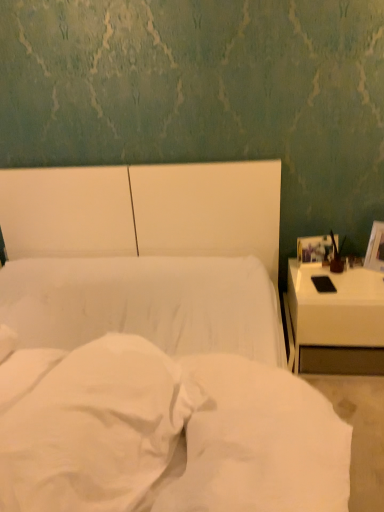
The height and width of the screenshot is (512, 384). Identify the location of white glossy nightstand at right. (335, 321).

In the scene shown: From the image's perspective, does white soft fabric at center appear higher than white fabric bed at center?

No.

From a real-world perspective, is white soft fabric at center positioned above or below white fabric bed at center?

Clearly, from a real-world perspective, white soft fabric at center is above white fabric bed at center.

What are the coordinates of `sheet located above the white fabric bed at center (from a real-world perspective)` in the screenshot? It's located at (260, 443).

Where is `sheet that is below the white glossy nightstand at right (from the image's perspective)`? sheet that is below the white glossy nightstand at right (from the image's perspective) is located at coordinates (260, 443).

Is white glossy nightstand at right in contact with white soft fabric at center?

No, white glossy nightstand at right is not in contact with white soft fabric at center.

From the image's perspective, is white glossy nightstand at right below white soft fabric at center?

No.

Can you tell me how much white soft pillow at center and matte brown vase at right differ in facing direction?

There is a 64-degree angle between the facing directions of white soft pillow at center and matte brown vase at right.

From the image's perspective, who appears lower, white soft pillow at center or matte brown vase at right?

white soft pillow at center, from the image's perspective.

Considering the positions of objects white soft pillow at center and matte brown vase at right in the image provided, who is behind, white soft pillow at center or matte brown vase at right?

matte brown vase at right is more distant.

Is white soft pillow at center wider than matte brown vase at right?

Yes, white soft pillow at center is wider than matte brown vase at right.

From a real-world perspective, between white soft fabric at center and matte brown vase at right, who is vertically higher?

In real-world perspective, white soft fabric at center is above.

Considering the relative sizes of white soft fabric at center and matte brown vase at right in the image provided, is white soft fabric at center taller than matte brown vase at right?

Correct, white soft fabric at center is much taller as matte brown vase at right.

Is point (219, 364) closer or farther from the camera than point (338, 271)?

Point (219, 364) is positioned closer to the camera compared to point (338, 271).

Are white soft fabric at center and matte brown vase at right beside each other?

No.

Based on the photo, is white glossy nightstand at right next to white fabric bed at center and touching it?

No, white glossy nightstand at right is not making contact with white fabric bed at center.

Could white fabric bed at center be considered to be inside white glossy nightstand at right?

No, white fabric bed at center is not a part of white glossy nightstand at right.

What's the angular difference between white glossy nightstand at right and white fabric bed at center's facing directions?

The angle between the facing direction of white glossy nightstand at right and the facing direction of white fabric bed at center is 0.122 degrees.

In terms of size, does white glossy nightstand at right appear bigger or smaller than white fabric bed at center?

Clearly, white glossy nightstand at right is smaller in size than white fabric bed at center.

Is white soft pillow at center to the left or to the right of white glossy nightstand at right in the image?

From the image, it's evident that white soft pillow at center is to the left of white glossy nightstand at right.

You are a GUI agent. You are given a task and a screenshot of the screen. Output one action in this format:
    pyautogui.click(x=<x>, y=<y>)
    Task: Click on the nightstand that is under the white soft pillow at center (from a real-world perspective)
    
    Given the screenshot: What is the action you would take?
    pyautogui.click(x=335, y=321)

How many degrees apart are the facing directions of white soft pillow at center and white glossy nightstand at right?

white soft pillow at center and white glossy nightstand at right are facing 66.8 degrees away from each other.

Considering the positions of objects white soft pillow at center and white glossy nightstand at right in the image provided, who is behind, white soft pillow at center or white glossy nightstand at right?

white glossy nightstand at right is more distant.

Is the position of matte brown vase at right more distant than that of white glossy nightstand at right?

Yes, matte brown vase at right is behind white glossy nightstand at right.

Looking at the image, does matte brown vase at right seem bigger or smaller compared to white glossy nightstand at right?

Clearly, matte brown vase at right is smaller in size than white glossy nightstand at right.

Measure the distance from matte brown vase at right to white glossy nightstand at right.

They are 12.45 inches apart.

Looking at their sizes, would you say matte brown vase at right is wider or thinner than white glossy nightstand at right?

matte brown vase at right is thinner than white glossy nightstand at right.

Where is `sheet that is on the right side of white fabric bed at center`? The height and width of the screenshot is (512, 384). sheet that is on the right side of white fabric bed at center is located at coordinates (260, 443).

The width and height of the screenshot is (384, 512). In the image, there is a white soft fabric at center. In order to click on nightstand above it (from the image's perspective) in this screenshot , I will do `click(335, 321)`.

When comparing their distances from white soft pillow at center, does matte brown vase at right or white soft fabric at center seem further?

The object further to white soft pillow at center is matte brown vase at right.

Which object lies further to the anchor point white fabric bed at center, white soft fabric at center or white glossy nightstand at right?

white glossy nightstand at right is further to white fabric bed at center.

Estimate the real-world distances between objects in this image. Which object is closer to white glossy nightstand at right, matte brown vase at right or white fabric bed at center?

Among the two, matte brown vase at right is located nearer to white glossy nightstand at right.

Looking at the image, which one is located closer to white soft fabric at center, white glossy nightstand at right or white soft pillow at center?

Based on the image, white soft pillow at center appears to be nearer to white soft fabric at center.

Based on their spatial positions, is white soft fabric at center or matte brown vase at right closer to white glossy nightstand at right?

matte brown vase at right.

From the image, which object appears to be nearer to matte brown vase at right, white soft fabric at center or white soft pillow at center?

white soft fabric at center lies closer to matte brown vase at right than the other object.

When comparing their distances from white soft pillow at center, does white glossy nightstand at right or white fabric bed at center seem further?

white glossy nightstand at right is positioned further to the anchor white soft pillow at center.

Which object lies nearer to the anchor point white glossy nightstand at right, white soft pillow at center or white fabric bed at center?

white fabric bed at center is positioned closer to the anchor white glossy nightstand at right.

Where is `nightstand between white soft fabric at center and matte brown vase at right from front to back`? The image size is (384, 512). nightstand between white soft fabric at center and matte brown vase at right from front to back is located at coordinates (335, 321).

What are the coordinates of `nightstand located between white soft pillow at center and matte brown vase at right in the depth direction` in the screenshot? It's located at (335, 321).

This screenshot has height=512, width=384. What are the coordinates of `pillow positioned between white fabric bed at center and matte brown vase at right from near to far` in the screenshot? It's located at (93, 426).

Find the location of a particular element. This screenshot has height=512, width=384. pillow between white fabric bed at center and white glossy nightstand at right in the front-back direction is located at coordinates (93, 426).